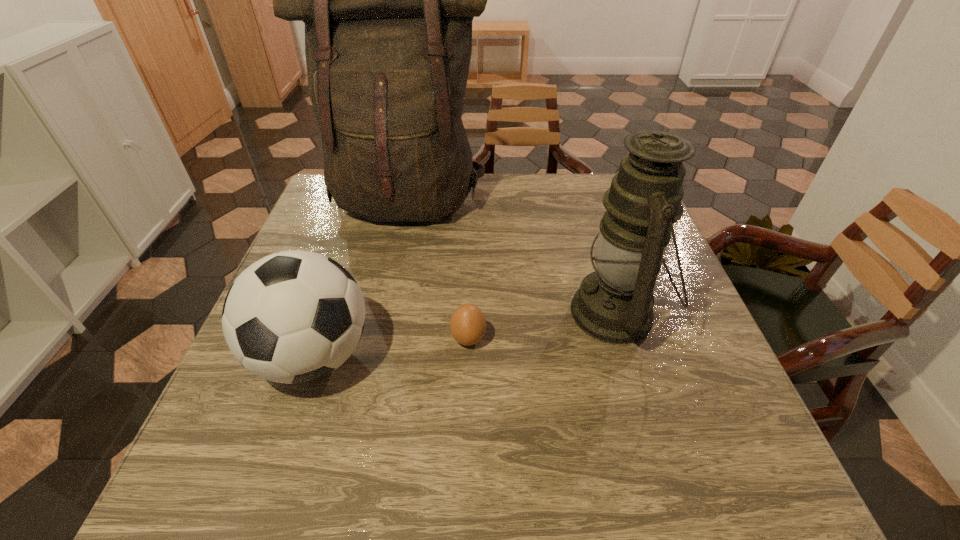
You are a GUI agent. You are given a task and a screenshot of the screen. Output one action in this format:
    pyautogui.click(x=<x>, y=<y>)
    Task: Click on the closest object to the backpack
    This screenshot has width=960, height=540.
    Given the screenshot: What is the action you would take?
    pyautogui.click(x=614, y=304)

Choose which object is the second nearest neighbor to the backpack. Please provide its 2D coordinates. Your answer should be formatted as a tuple, i.e. [(x, y)], where the tuple contains the x and y coordinates of a point satisfying the conditions above.

[(295, 316)]

The image size is (960, 540). Identify the location of vacant area in the image that satisfies the following two spatial constraints: 1. on the open flap of the boiled egg; 2. on the left side of the tallest object. (376, 339).

Where is `free point that satisfies the following two spatial constraints: 1. on the open flap of the farthest object; 2. on the right side of the oil lamp`? Image resolution: width=960 pixels, height=540 pixels. free point that satisfies the following two spatial constraints: 1. on the open flap of the farthest object; 2. on the right side of the oil lamp is located at coordinates (382, 313).

You are a GUI agent. You are given a task and a screenshot of the screen. Output one action in this format:
    pyautogui.click(x=<x>, y=<y>)
    Task: Click on the vacant space that satisfies the following two spatial constraints: 1. on the open flap of the rightmost object; 2. on the right side of the farthest object
    The image size is (960, 540).
    Given the screenshot: What is the action you would take?
    pyautogui.click(x=382, y=313)